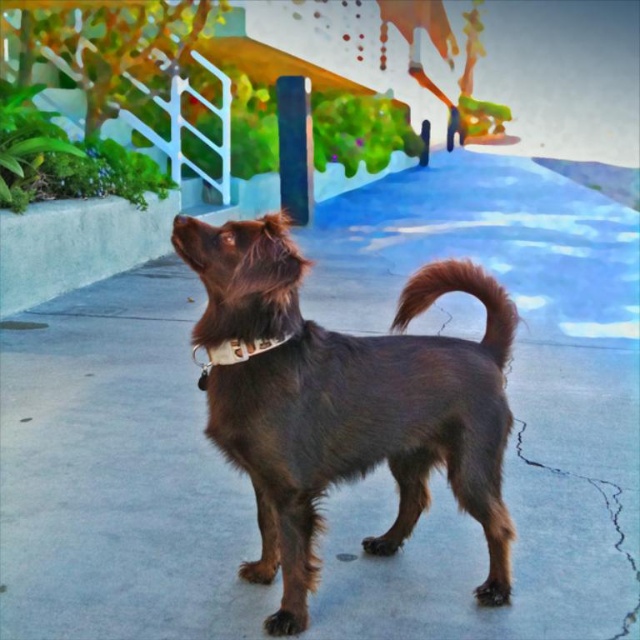
Which is more to the left, brown furry dog at center or brown fur nose at center?

brown fur nose at center is more to the left.

Can you confirm if brown furry dog at center is smaller than brown fur nose at center?

Actually, brown furry dog at center might be larger than brown fur nose at center.

At what (x,y) coordinates should I click in order to perform the action: click on brown furry dog at center. Please return your answer as a coordinate pair (x, y). Looking at the image, I should click on (348, 403).

Can you confirm if brown furry tail at center is positioned below brown fur nose at center?

Indeed, brown furry tail at center is positioned under brown fur nose at center.

Between point (502, 326) and point (180, 227), which one is positioned in front?

Point (180, 227)

Is point (502, 336) behind point (177, 221)?

Yes, point (502, 336) is farther from viewer.

You are a GUI agent. You are given a task and a screenshot of the screen. Output one action in this format:
    pyautogui.click(x=<x>, y=<y>)
    Task: Click on the brown furry tail at center
    This screenshot has width=640, height=640.
    Given the screenshot: What is the action you would take?
    pyautogui.click(x=465, y=292)

Looking at this image, between brown furry dog at center and brown furry tail at center, which one appears on the right side from the viewer's perspective?

brown furry tail at center is more to the right.

Does brown furry dog at center have a lesser height compared to brown furry tail at center?

No.

What do you see at coordinates (348, 403) in the screenshot?
I see `brown furry dog at center` at bounding box center [348, 403].

Locate an element on the screen. The height and width of the screenshot is (640, 640). brown furry dog at center is located at coordinates (348, 403).